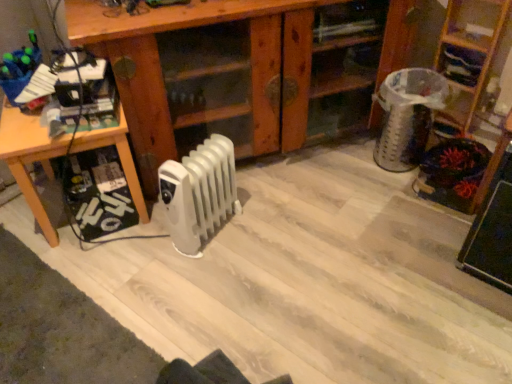
This screenshot has height=384, width=512. Describe the element at coordinates (472, 44) in the screenshot. I see `wooden bookshelf at upper right, the first shelf from the right` at that location.

At what (x,y) coordinates should I click in order to perform the action: click on wooden table at left. Please return your answer as a coordinate pair (x, y). Looking at the image, I should click on (30, 159).

Image resolution: width=512 pixels, height=384 pixels. What do you see at coordinates (199, 193) in the screenshot?
I see `white plastic radiator at center` at bounding box center [199, 193].

In order to face wooden bookshelf at upper right, which is counted as the second shelf, starting from the right, should I rotate leftwards or rightwards?

Rotate your view right by about 25.500°.

This screenshot has height=384, width=512. What do you see at coordinates (460, 64) in the screenshot?
I see `wooden bookshelf at upper right, which ranks as the second shelf in left-to-right order` at bounding box center [460, 64].

Image resolution: width=512 pixels, height=384 pixels. In order to click on wooden bookshelf at upper right, the first shelf from the right in this screenshot , I will do `click(472, 44)`.

Considering the relative sizes of wooden table at left and wooden bookshelf at upper right, the third shelf from the left, in the image provided, is wooden table at left thinner than wooden bookshelf at upper right, the third shelf from the left,?

In fact, wooden table at left might be wider than wooden bookshelf at upper right, the third shelf from the left.

Could you tell me if wooden table at left is turned towards wooden bookshelf at upper right, the first shelf from the right?

No, wooden table at left is not aimed at wooden bookshelf at upper right, the first shelf from the right.

Which is in front, wooden table at left or wooden bookshelf at upper right, the first shelf from the right?

wooden table at left is in front.

Between wooden table at left and wooden bookshelf at upper right, the third shelf from the left, which one appears on the left side from the viewer's perspective?

wooden table at left.

Looking at the image, does wooden bookshelf at upper right, which is counted as the second shelf, starting from the right, seem bigger or smaller compared to wooden table at left?

In the image, wooden bookshelf at upper right, which is counted as the second shelf, starting from the right, appears to be smaller than wooden table at left.

From the image's perspective, which shelf is the 2nd one above the wooden table at left? Please provide its 2D coordinates.

[(460, 64)]

Is wooden table at left at the back of wooden bookshelf at upper right, which ranks as the second shelf in left-to-right order?

That's not correct — wooden bookshelf at upper right, which ranks as the second shelf in left-to-right order, is not looking away from wooden table at left.

Is wooden bookshelf at upper right, which is counted as the second shelf, starting from the right, positioned in front of wooden table at left?

No, wooden bookshelf at upper right, which is counted as the second shelf, starting from the right, is further to the viewer.

Is wooden table at left bigger or smaller than white plastic radiator at center?

In the image, wooden table at left appears to be larger than white plastic radiator at center.

The height and width of the screenshot is (384, 512). I want to click on radiator in front of the wooden table at left, so click(199, 193).

Which of these two, wooden table at left or white plastic radiator at center, stands taller?

With more height is wooden table at left.

From a real-world perspective, is wooden table at left positioned above or below white plastic radiator at center?

wooden table at left is situated higher than white plastic radiator at center in the real world.

Is white plastic radiator at center far away from wooden table at left?

That's not correct — white plastic radiator at center is a little close to wooden table at left.

In the scene shown: Which object is further away from the camera taking this photo, white plastic radiator at center or wooden table at left?

Positioned behind is wooden table at left.

Who is bigger, white plastic radiator at center or wooden table at left?

Bigger between the two is wooden table at left.

In order to click on table on the left of white plastic radiator at center in this screenshot , I will do `click(30, 159)`.

Is wooden cabinet at center, acting as the 1th shelf starting from the left, bigger or smaller than white plastic radiator at center?

wooden cabinet at center, acting as the 1th shelf starting from the left, is bigger than white plastic radiator at center.

Is the surface of wooden cabinet at center, acting as the 1th shelf starting from the left, in direct contact with white plastic radiator at center?

wooden cabinet at center, acting as the 1th shelf starting from the left, and white plastic radiator at center are clearly separated.

From a real-world perspective, is wooden cabinet at center, acting as the 1th shelf starting from the left, positioned under white plastic radiator at center based on gravity?

No, from a real-world perspective, wooden cabinet at center, acting as the 1th shelf starting from the left, is not under white plastic radiator at center.

Can you see wooden bookshelf at upper right, which is counted as the second shelf, starting from the right, touching wooden cabinet at center, the 3th shelf positioned from the right?

wooden bookshelf at upper right, which is counted as the second shelf, starting from the right, is not next to wooden cabinet at center, the 3th shelf positioned from the right, and they're not touching.

Is wooden bookshelf at upper right, which ranks as the second shelf in left-to-right order, aimed at wooden cabinet at center, the 3th shelf positioned from the right?

No, wooden bookshelf at upper right, which ranks as the second shelf in left-to-right order, does not turn towards wooden cabinet at center, the 3th shelf positioned from the right.

Can you confirm if wooden bookshelf at upper right, which ranks as the second shelf in left-to-right order, is bigger than wooden cabinet at center, acting as the 1th shelf starting from the left?

No, wooden bookshelf at upper right, which ranks as the second shelf in left-to-right order, is not bigger than wooden cabinet at center, acting as the 1th shelf starting from the left.

In the image, is wooden bookshelf at upper right, which ranks as the second shelf in left-to-right order, positioned in front of or behind wooden cabinet at center, the 3th shelf positioned from the right?

wooden bookshelf at upper right, which ranks as the second shelf in left-to-right order, is positioned farther from the viewer than wooden cabinet at center, the 3th shelf positioned from the right.

Is wooden cabinet at center, the 3th shelf positioned from the right, positioned behind wooden bookshelf at upper right, which is counted as the second shelf, starting from the right?

That is False.

Considering the sizes of wooden cabinet at center, acting as the 1th shelf starting from the left, and wooden bookshelf at upper right, which is counted as the second shelf, starting from the right, in the image, is wooden cabinet at center, acting as the 1th shelf starting from the left, wider or thinner than wooden bookshelf at upper right, which is counted as the second shelf, starting from the right,?

Considering their sizes, wooden cabinet at center, acting as the 1th shelf starting from the left, looks broader than wooden bookshelf at upper right, which is counted as the second shelf, starting from the right.

From the image's perspective, which shelf is the 3rd one above the wooden table at left? Please provide its 2D coordinates.

[(472, 44)]

Locate an element on the screen. Image resolution: width=512 pixels, height=384 pixels. table directly beneath the wooden bookshelf at upper right, which is counted as the second shelf, starting from the right (from a real-world perspective) is located at coordinates (30, 159).

From the image, which object appears to be farther from wooden table at left, wooden cabinet at center, the 3th shelf positioned from the right, or white plastic radiator at center?

Based on the image, wooden cabinet at center, the 3th shelf positioned from the right, appears to be further to wooden table at left.

Considering their positions, is wooden table at left positioned closer to wooden bookshelf at upper right, the third shelf from the left, than white plastic radiator at center?

white plastic radiator at center is positioned closer to the anchor wooden bookshelf at upper right, the third shelf from the left.

From the image, which object appears to be farther from wooden bookshelf at upper right, which ranks as the second shelf in left-to-right order, wooden cabinet at center, acting as the 1th shelf starting from the left, or wooden bookshelf at upper right, the first shelf from the right?

The object further to wooden bookshelf at upper right, which ranks as the second shelf in left-to-right order, is wooden cabinet at center, acting as the 1th shelf starting from the left.

Looking at the image, which one is located closer to white plastic radiator at center, wooden bookshelf at upper right, which is counted as the second shelf, starting from the right, or wooden table at left?

wooden table at left is positioned closer to the anchor white plastic radiator at center.

Based on their spatial positions, is wooden cabinet at center, acting as the 1th shelf starting from the left, or wooden bookshelf at upper right, which ranks as the second shelf in left-to-right order, closer to wooden table at left?

The object closer to wooden table at left is wooden cabinet at center, acting as the 1th shelf starting from the left.

Which object lies nearer to the anchor point white plastic radiator at center, wooden table at left or wooden cabinet at center, acting as the 1th shelf starting from the left?

wooden table at left.

Which object lies further to the anchor point white plastic radiator at center, wooden table at left or wooden bookshelf at upper right, which ranks as the second shelf in left-to-right order?

Among the two, wooden bookshelf at upper right, which ranks as the second shelf in left-to-right order, is located further to white plastic radiator at center.

From the image, which object appears to be farther from wooden table at left, wooden bookshelf at upper right, the first shelf from the right, or white plastic radiator at center?

wooden bookshelf at upper right, the first shelf from the right, is positioned further to the anchor wooden table at left.

At what (x,y) coordinates should I click in order to perform the action: click on shelf between wooden table at left and wooden bookshelf at upper right, which is counted as the second shelf, starting from the right, from left to right. Please return your answer as a coordinate pair (x, y). Image resolution: width=512 pixels, height=384 pixels. Looking at the image, I should click on (245, 70).

Where is `shelf between wooden cabinet at center, the 3th shelf positioned from the right, and wooden bookshelf at upper right, the third shelf from the left`? shelf between wooden cabinet at center, the 3th shelf positioned from the right, and wooden bookshelf at upper right, the third shelf from the left is located at coordinates (460, 64).

Image resolution: width=512 pixels, height=384 pixels. In order to click on radiator between wooden table at left and wooden bookshelf at upper right, the first shelf from the right in this screenshot , I will do `click(199, 193)`.

Locate an element on the screen. This screenshot has height=384, width=512. radiator between wooden table at left and wooden cabinet at center, acting as the 1th shelf starting from the left is located at coordinates pyautogui.click(x=199, y=193).